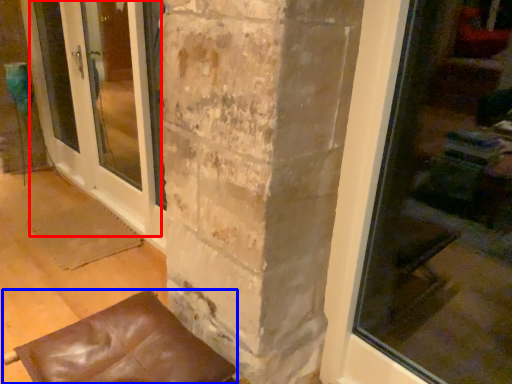
Question: Which of the following is the closest to the observer, screen door (highlighted by a red box) or furniture (highlighted by a blue box)?

Choices:
 (A) screen door
 (B) furniture

Answer: (B)